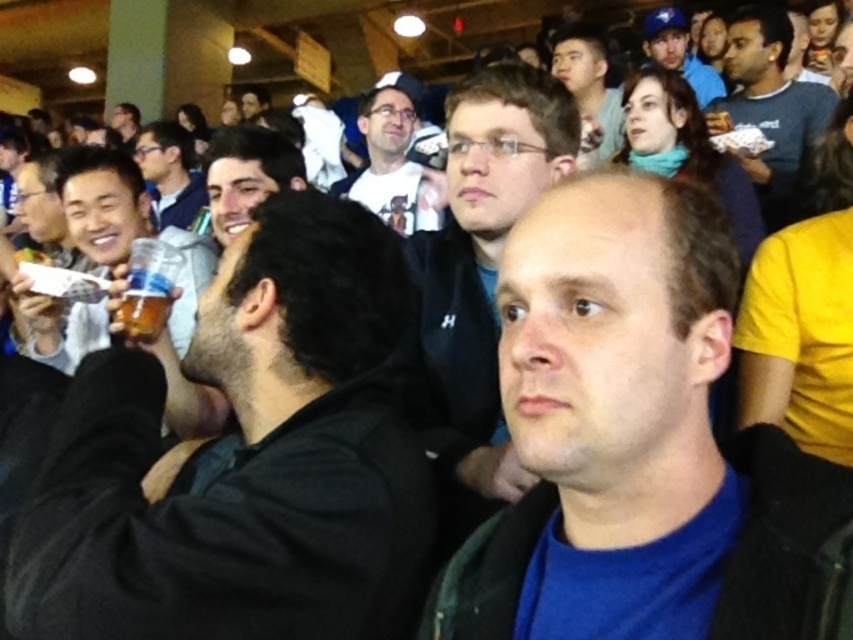
Can you confirm if black matte cup at left is positioned below smooth skin face at upper center?

Yes.

Which is below, black matte cup at left or smooth skin face at upper center?

Positioned lower is black matte cup at left.

Is point (238, 241) positioned before point (599, 44)?

Yes, it is in front of point (599, 44).

Locate an element on the screen. The height and width of the screenshot is (640, 853). black matte cup at left is located at coordinates (245, 460).

Between matte black jacket at center and matte black jacket at upper center, which one appears on the right side from the viewer's perspective?

matte black jacket at center is more to the right.

Between point (525, 96) and point (193, 163), which one is positioned behind?

The point (193, 163) is more distant.

Which is in front, point (500, 456) or point (169, 147)?

Positioned in front is point (500, 456).

In order to click on matte black jacket at center in this screenshot , I will do `click(485, 250)`.

Between point (428, 317) and point (41, 340), which one is positioned in front?

Point (428, 317) is more forward.

Identify the location of matte black jacket at center. (485, 250).

Where is `matte black jacket at center`? This screenshot has height=640, width=853. matte black jacket at center is located at coordinates (485, 250).